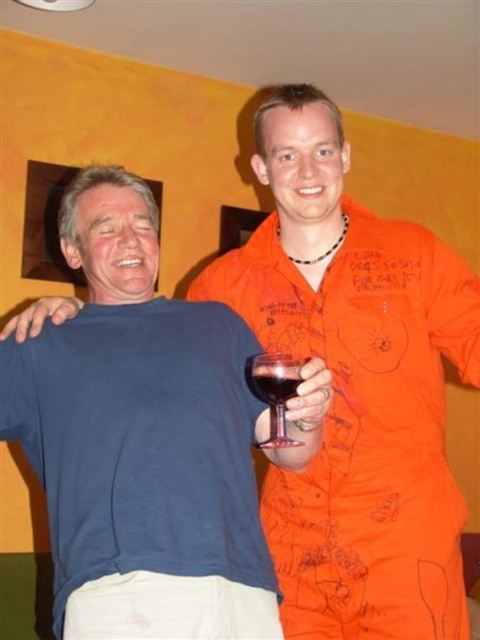
Question: Does transparent glass at right have a smaller size compared to translucent glass at upper center?

Choices:
 (A) yes
 (B) no

Answer: (B)

Question: Among these points, which one is nearest to the camera?

Choices:
 (A) (277, 369)
 (B) (265, 394)

Answer: (A)

Question: Can you confirm if transparent glass at right is positioned below translucent glass at upper center?

Choices:
 (A) no
 (B) yes

Answer: (B)

Question: Observing the image, what is the correct spatial positioning of transparent glass at right in reference to translucent glass at upper center?

Choices:
 (A) below
 (B) above

Answer: (A)